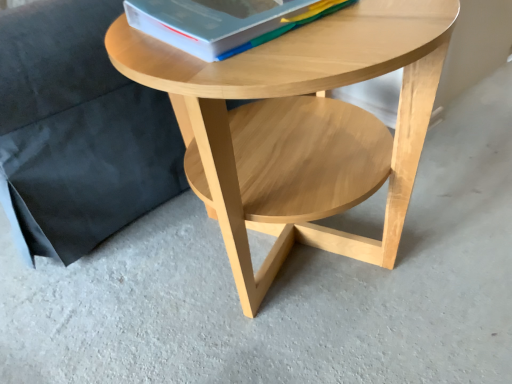
Identify the location of matte wood armchair at upper left. (78, 130).

Measure the distance between point (x=148, y=10) and camera.

27.99 inches.

In order to click on hardcover book at upper center in this screenshot , I will do `click(222, 22)`.

In order to face natural wood coffee table at center, should I rotate leftwards or rightwards?

Rotate right and turn 4.347 degrees.

What are the coordinates of `natural wood coffee table at center` in the screenshot? It's located at (300, 127).

What are the coordinates of `matte wood armchair at upper left` in the screenshot? It's located at (78, 130).

Is hardcover book at upper center with natural wood coffee table at center?

No, hardcover book at upper center is not with natural wood coffee table at center.

Can you tell me how much hardcover book at upper center and natural wood coffee table at center differ in facing direction?

2.71 degrees.

Considering the relative sizes of hardcover book at upper center and natural wood coffee table at center in the image provided, is hardcover book at upper center bigger than natural wood coffee table at center?

No.

Measure the distance from natural wood coffee table at center to hardcover book at upper center.

8.88 inches.

Is natural wood coffee table at center wider than hardcover book at upper center?

Indeed, natural wood coffee table at center has a greater width compared to hardcover book at upper center.

Who is shorter, natural wood coffee table at center or hardcover book at upper center?

hardcover book at upper center.

Relative to hardcover book at upper center, is natural wood coffee table at center in front or behind?

In the image, natural wood coffee table at center appears in front of hardcover book at upper center.

From their relative heights in the image, would you say natural wood coffee table at center is taller or shorter than matte wood armchair at upper left?

In the image, natural wood coffee table at center appears to be shorter than matte wood armchair at upper left.

From a real-world perspective, is natural wood coffee table at center above or below matte wood armchair at upper left?

Clearly, from a real-world perspective, natural wood coffee table at center is below matte wood armchair at upper left.

Can you confirm if natural wood coffee table at center is smaller than matte wood armchair at upper left?

Indeed, natural wood coffee table at center has a smaller size compared to matte wood armchair at upper left.

Is natural wood coffee table at center oriented towards matte wood armchair at upper left?

No, natural wood coffee table at center is not oriented towards matte wood armchair at upper left.

Is hardcover book at upper center positioned far away from matte wood armchair at upper left?

Actually, hardcover book at upper center and matte wood armchair at upper left are a little close together.

How many degrees apart are the facing directions of hardcover book at upper center and matte wood armchair at upper left?

They differ by 2.71 degrees in their facing directions.

Considering the positions of objects hardcover book at upper center and matte wood armchair at upper left in the image provided, who is behind, hardcover book at upper center or matte wood armchair at upper left?

matte wood armchair at upper left.

How far apart are hardcover book at upper center and matte wood armchair at upper left?

hardcover book at upper center and matte wood armchair at upper left are 15.42 inches apart.

Is matte wood armchair at upper left closer to the viewer compared to natural wood coffee table at center?

No, the depth of matte wood armchair at upper left is greater than that of natural wood coffee table at center.

Would you say matte wood armchair at upper left contains natural wood coffee table at center?

No, natural wood coffee table at center is not surrounded by matte wood armchair at upper left.

From the image's perspective, is matte wood armchair at upper left located above or below natural wood coffee table at center?

Based on their image positions, matte wood armchair at upper left is located above natural wood coffee table at center.

Does point (79, 25) appear closer or farther from the camera than point (409, 188)?

Point (79, 25).

Can you confirm if matte wood armchair at upper left is smaller than hardcover book at upper center?

Actually, matte wood armchair at upper left might be larger than hardcover book at upper center.

Identify the location of paperback book to the right of matte wood armchair at upper left. This screenshot has height=384, width=512. (222, 22).

From the image's perspective, is matte wood armchair at upper left below hardcover book at upper center?

No, from the image's perspective, matte wood armchair at upper left is not beneath hardcover book at upper center.

Would you say hardcover book at upper center is part of matte wood armchair at upper left's contents?

No, hardcover book at upper center is not surrounded by matte wood armchair at upper left.

You are a GUI agent. You are given a task and a screenshot of the screen. Output one action in this format:
    pyautogui.click(x=<x>, y=<y>)
    Task: Click on the paperback book that appears above the natural wood coffee table at center (from a real-world perspective)
    
    Given the screenshot: What is the action you would take?
    pyautogui.click(x=222, y=22)

The width and height of the screenshot is (512, 384). Identify the location of coffee table that appears in front of the hardcover book at upper center. (300, 127).

Based on their spatial positions, is matte wood armchair at upper left or natural wood coffee table at center further from hardcover book at upper center?

matte wood armchair at upper left.

Which object lies further to the anchor point matte wood armchair at upper left, natural wood coffee table at center or hardcover book at upper center?

hardcover book at upper center is further to matte wood armchair at upper left.

Based on their spatial positions, is matte wood armchair at upper left or hardcover book at upper center closer to natural wood coffee table at center?

Based on the image, hardcover book at upper center appears to be nearer to natural wood coffee table at center.

Considering their positions, is natural wood coffee table at center positioned further to hardcover book at upper center than matte wood armchair at upper left?

matte wood armchair at upper left.

Based on their spatial positions, is hardcover book at upper center or matte wood armchair at upper left further from natural wood coffee table at center?

matte wood armchair at upper left lies further to natural wood coffee table at center than the other object.

Looking at the image, which one is located further to matte wood armchair at upper left, hardcover book at upper center or natural wood coffee table at center?

Based on the image, hardcover book at upper center appears to be further to matte wood armchair at upper left.

Locate an element on the screen. paperback book between matte wood armchair at upper left and natural wood coffee table at center from left to right is located at coordinates (222, 22).